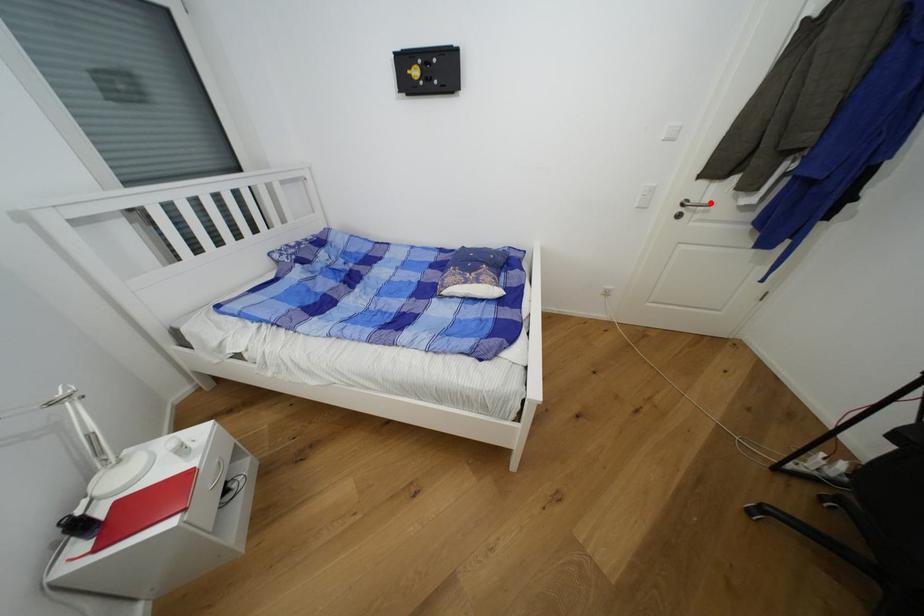
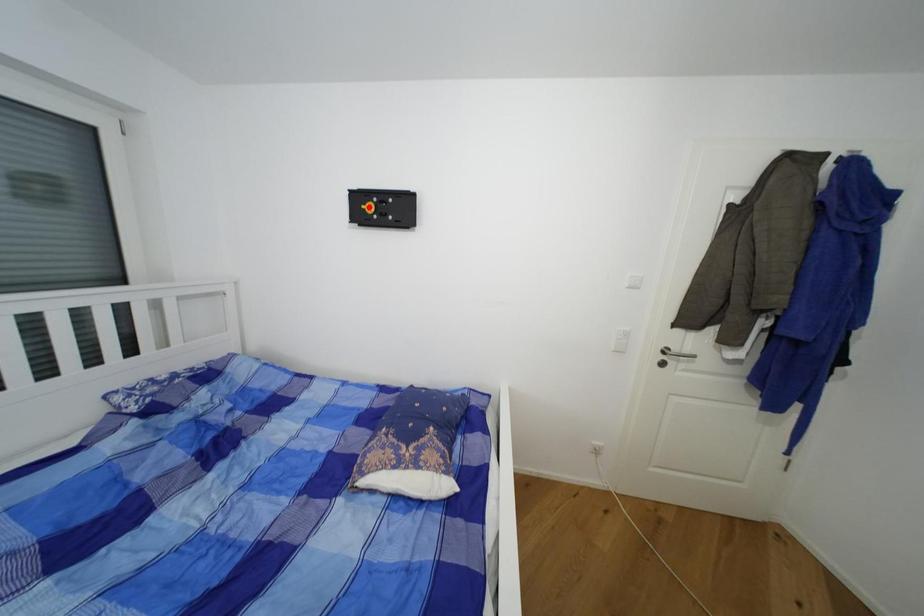
I am providing you with two images of the same scene from different viewpoints. A red point is marked on the first image and another point is marked on the second image. Does the point marked in image1 correspond to the same location as the one in image2?

No